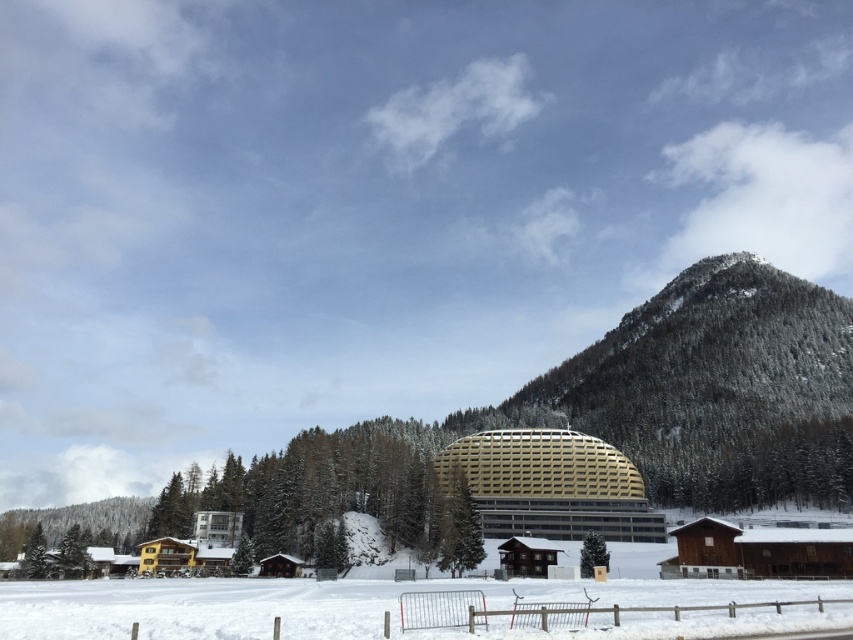
Question: Based on their relative distances, which object is farther from the green textured mountain at center?

Choices:
 (A) gold metallic dome at center
 (B) white powdery snow at lower center

Answer: (B)

Question: Can you confirm if green textured mountain at center is thinner than gold metallic dome at center?

Choices:
 (A) yes
 (B) no

Answer: (B)

Question: Which of these objects is positioned farthest from the green textured mountain at center?

Choices:
 (A) white powdery snow at lower center
 (B) gold metallic dome at center

Answer: (A)

Question: Which is farther from the white powdery snow at lower center?

Choices:
 (A) green textured mountain at center
 (B) gold metallic dome at center

Answer: (A)

Question: Does green textured mountain at center have a greater width compared to white powdery snow at lower center?

Choices:
 (A) no
 (B) yes

Answer: (B)

Question: Does green textured mountain at center appear over gold metallic dome at center?

Choices:
 (A) yes
 (B) no

Answer: (A)